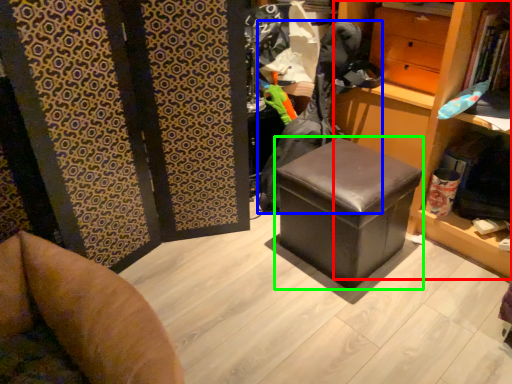
Question: Which object is positioned farthest from bookshelf (highlighted by a red box)? Select from clothing (highlighted by a blue box) and stool (highlighted by a green box).

Choices:
 (A) clothing
 (B) stool

Answer: (B)